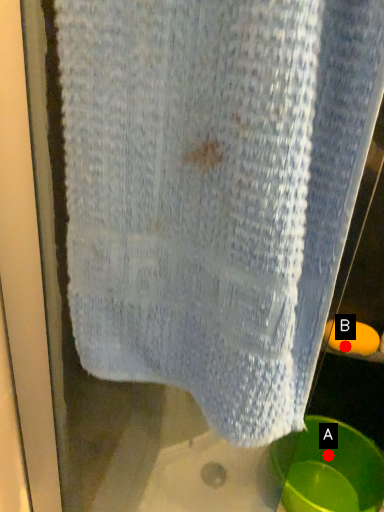
Question: Two points are circled on the image, labeled by A and B beside each circle. Which point appears closest to the camera in this image?

Choices:
 (A) A is closer
 (B) B is closer

Answer: (B)